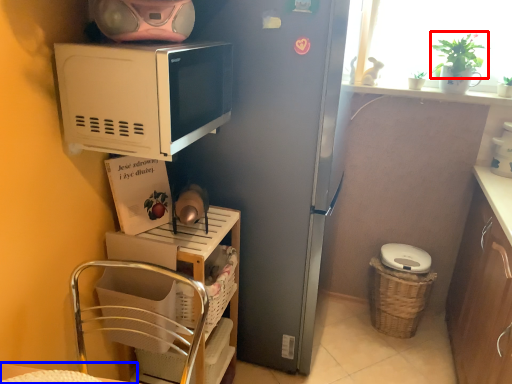
Question: Which point is further to the camera, plant (highlighted by a red box) or table (highlighted by a blue box)?

Choices:
 (A) plant
 (B) table

Answer: (A)